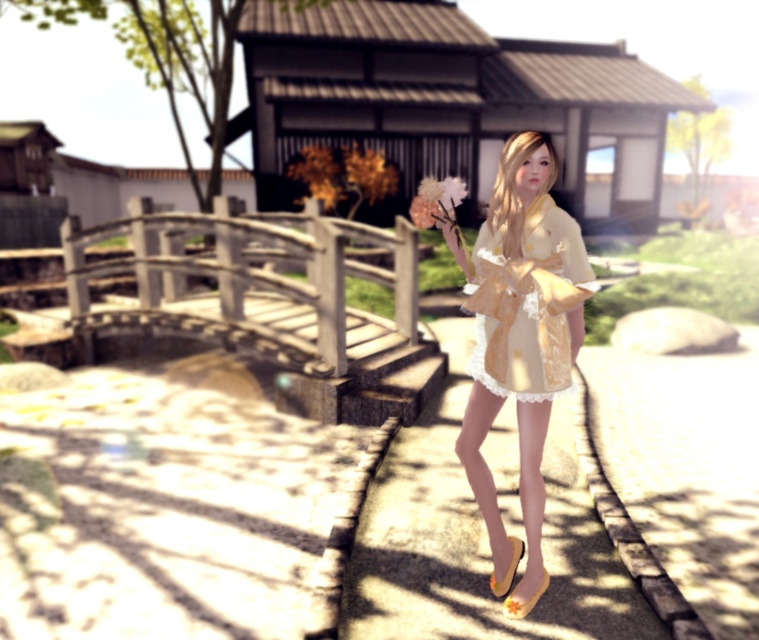
You are a photographer standing at the edge of the garden. You want to take a closeup shot of the matte pink flower at center while keeping the light yellow lace dress at center visible in the background. Can you fit both in the frame if your camera has a 50mm lens? Explain why.

The distance between the light yellow lace dress at center and the matte pink flower at center is 24.09 inches. With a 50mm lens, the field of view is wide enough to capture both objects at this distance, so yes, you can fit both in the frame.